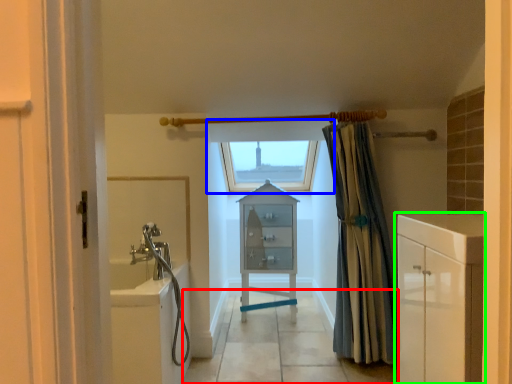
Question: Which object is the closest to the path (highlighted by a red box)? Choose among these: window (highlighted by a blue box) or bathroom cabinet (highlighted by a green box).

Choices:
 (A) window
 (B) bathroom cabinet

Answer: (B)